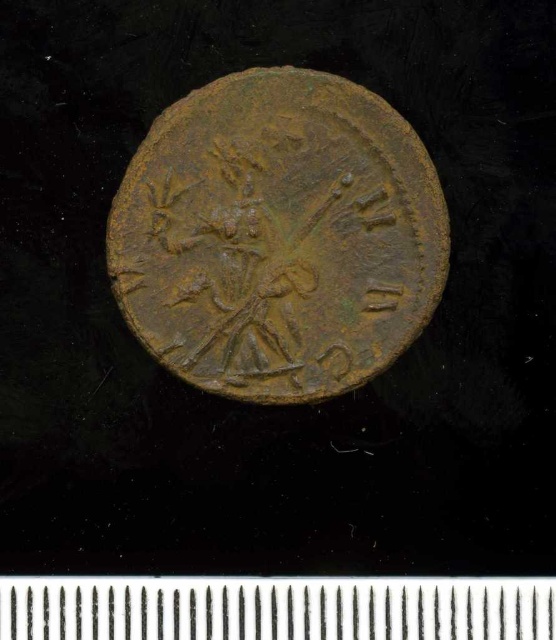
Is rusty bronze coin at center bigger than metallic silver ruler at center?

Correct, rusty bronze coin at center is larger in size than metallic silver ruler at center.

Which is behind, point (345, 291) or point (225, 614)?

Point (345, 291)

Identify the location of rusty bronze coin at center. (278, 236).